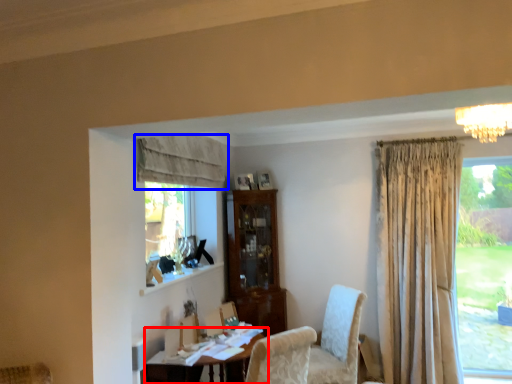
Question: Among these objects, which one is farthest to the camera, table (highlighted by a red box) or curtain (highlighted by a blue box)?

Choices:
 (A) table
 (B) curtain

Answer: (B)